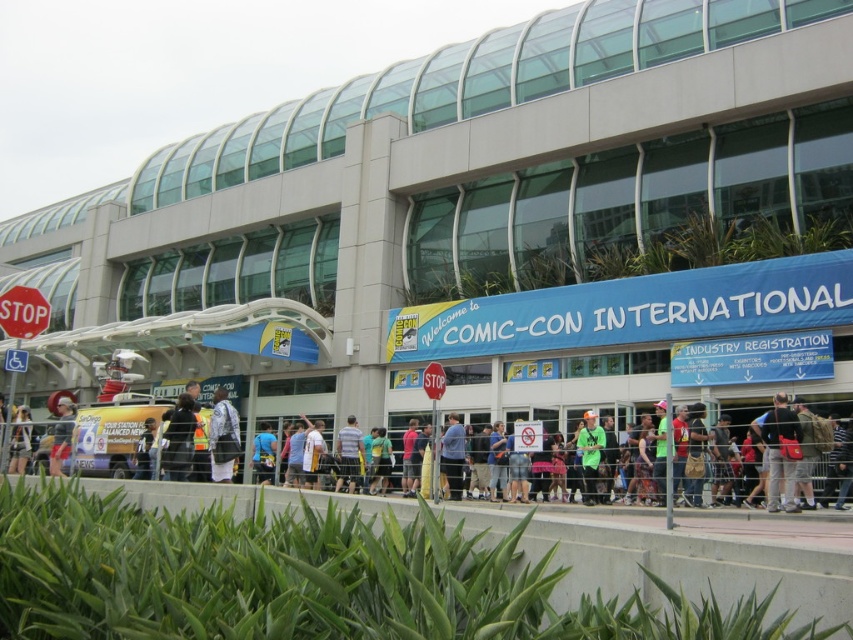
Is dark gray backpack at center positioned at the back of blue shirt at center?

No, dark gray backpack at center is in front of blue shirt at center.

Is point (183, 435) closer to camera compared to point (463, 435)?

Yes, point (183, 435) is in front of point (463, 435).

Is point (186, 442) positioned behind point (447, 477)?

No, it is in front of (447, 477).

The height and width of the screenshot is (640, 853). I want to click on dark gray backpack at center, so click(178, 440).

Is white cotton shirt at lower left below blue fabric shirt at center?

No, white cotton shirt at lower left is not below blue fabric shirt at center.

Where is `white cotton shirt at lower left`? This screenshot has height=640, width=853. white cotton shirt at lower left is located at coordinates (61, 435).

Is point (456, 422) positioned before point (51, 458)?

Yes, point (456, 422) is closer to viewer.

Is blue shirt at center above white cotton shirt at lower left?

Incorrect, blue shirt at center is not positioned above white cotton shirt at lower left.

Is point (456, 419) farther from viewer compared to point (62, 456)?

Yes, point (456, 419) is behind point (62, 456).

At what (x,y) coordinates should I click in order to perform the action: click on blue shirt at center. Please return your answer as a coordinate pair (x, y). Looking at the image, I should click on (451, 456).